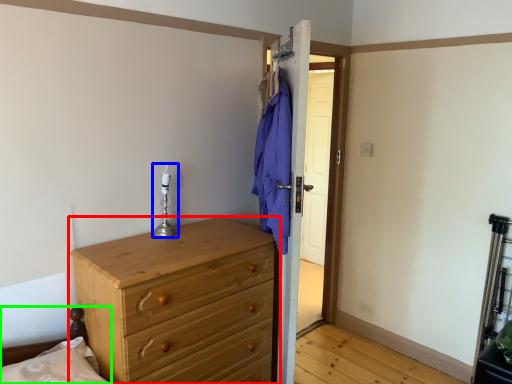
Question: Considering the real-world distances, which object is closest to chest of drawers (highlighted by a red box)? candle holder (highlighted by a blue box) or bed frame (highlighted by a green box).

Choices:
 (A) candle holder
 (B) bed frame

Answer: (B)